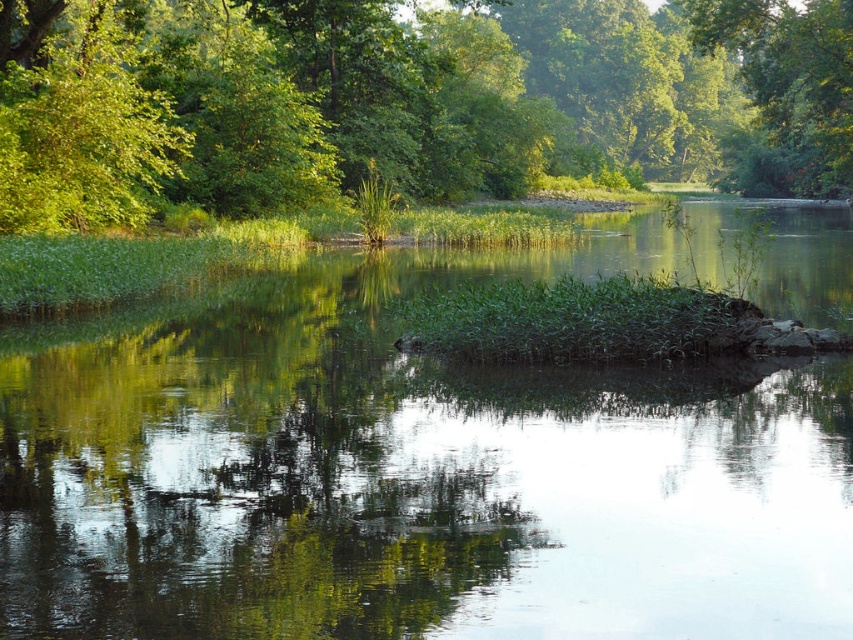
You are standing on the grassy island in the foreground and want to cross to the opposite bank. The transparent water at center is between you and the green leafy tree at upper center. Can you walk directly across the water to reach the tree?

The transparent water at center is shorter than the green leafy tree at upper center, meaning the water is not deep enough to prevent walking. Therefore, you can walk directly across the transparent water at center to reach the green leafy tree at upper center.

You are standing on the grassy island in the foreground and want to walk towards the green leafy tree at upper center and the green leafy tree at upper right. Which tree will you reach first?

You will reach the green leafy tree at upper center first because it is closer to you than the green leafy tree at upper right.

You are standing at the edge of the river and see the point marked at coordinates (405, 99). What is the object located at this point?

The point at coordinates (405, 99) marks a green leafy tree at upper center.